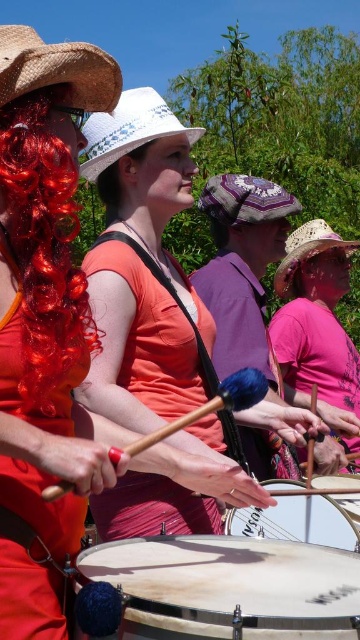
You are a photographer positioned in the middle of the scene. You want to take a photo that includes both the straw textured cowboy hat at upper left and the rustic straw cowboy hat at center. However, you notice that one of the hats is blocking the view of the other. Which hat is blocking the other one?

The straw textured cowboy hat at upper left is in front of rustic straw cowboy hat at center, so it is blocking the view of the rustic straw cowboy hat at center.

You are a photographer trying to capture a group photo of the two people in the scene. You notice that the blonde hair at center and the smooth white drum at center are both in the frame. Given that the photographer wants to ensure both are fully visible without cropping, which object should be positioned closer to the camera to avoid being cut off?

The smooth white drum at center should be positioned closer to the camera because its width is smaller than the blonde hair at center, making it easier to fit within the frame without cropping.

Based on the coordinates provided in the scene, can you identify the object located at point (56, 68)?

The object at point (56, 68) is the straw textured cowboy hat at upper left.